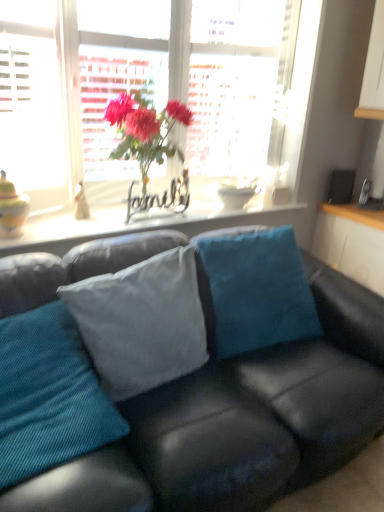
Question: From a real-world perspective, relative to matte glass window at upper center, is teal corduroy pillow at center, which is counted as the 1th pillow, starting from the right, vertically above or below?

Choices:
 (A) below
 (B) above

Answer: (A)

Question: From the image's perspective, is teal corduroy pillow at center, acting as the 3th pillow starting from the left, positioned above or below matte glass window at upper center?

Choices:
 (A) above
 (B) below

Answer: (B)

Question: Which object is positioned farthest from the matte glass window sill at center?

Choices:
 (A) black leather couch at center
 (B) matte yellow vase at left
 (C) matte glass vase at center
 (D) white glossy cabinet at right
 (E) light blue fabric pillow at center, positioned as the second pillow in right-to-left order

Answer: (A)

Question: Which object is the closest to the matte yellow vase at left?

Choices:
 (A) teal corduroy pillow at center, which appears as the 1th pillow when viewed from the left
 (B) white glossy cabinet at right
 (C) teal corduroy pillow at center, acting as the 3th pillow starting from the left
 (D) black leather couch at center
 (E) matte glass window at upper center

Answer: (A)